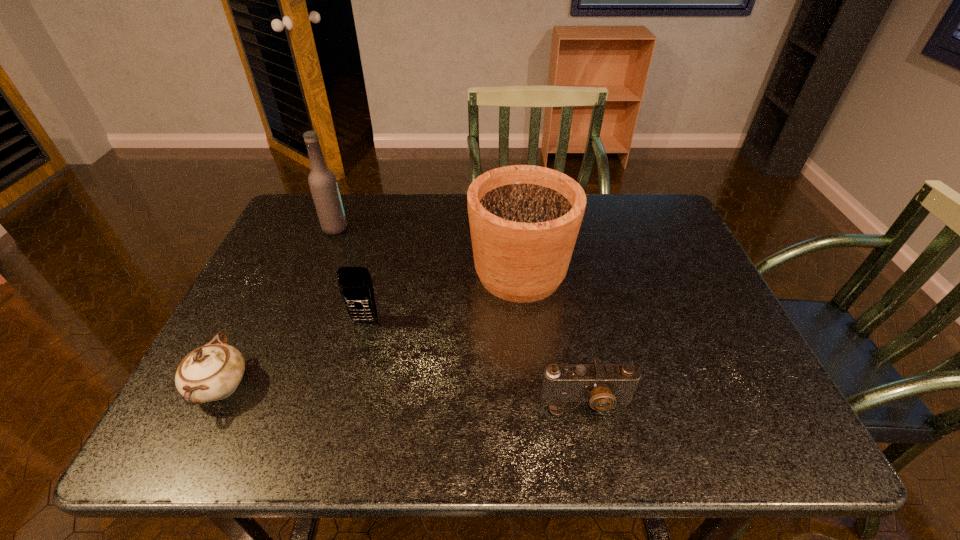
The height and width of the screenshot is (540, 960). Find the location of `free space at the far edge`. free space at the far edge is located at coordinates (433, 212).

In order to click on free space at the near edge in this screenshot , I will do `click(705, 435)`.

You are a GUI agent. You are given a task and a screenshot of the screen. Output one action in this format:
    pyautogui.click(x=<x>, y=<y>)
    Task: Click on the vacant space at the left edge of the desktop
    
    Given the screenshot: What is the action you would take?
    pyautogui.click(x=312, y=248)

The height and width of the screenshot is (540, 960). I want to click on free spot at the right edge of the desktop, so click(684, 341).

The height and width of the screenshot is (540, 960). What are the coordinates of `vacant space at the far right corner of the desktop` in the screenshot? It's located at (641, 227).

The image size is (960, 540). I want to click on vacant area at the near right corner, so click(x=764, y=432).

Locate an element on the screen. blank region between the third shortest object and the leftmost object is located at coordinates (293, 354).

Image resolution: width=960 pixels, height=540 pixels. What are the coordinates of `free area in between the camera and the third nearest object` in the screenshot? It's located at (476, 360).

Locate an element on the screen. vacant area between the fourth nearest object and the camera is located at coordinates (x=554, y=337).

Find the location of a particular element. vacant area that lies between the beer bottle and the camera is located at coordinates (461, 314).